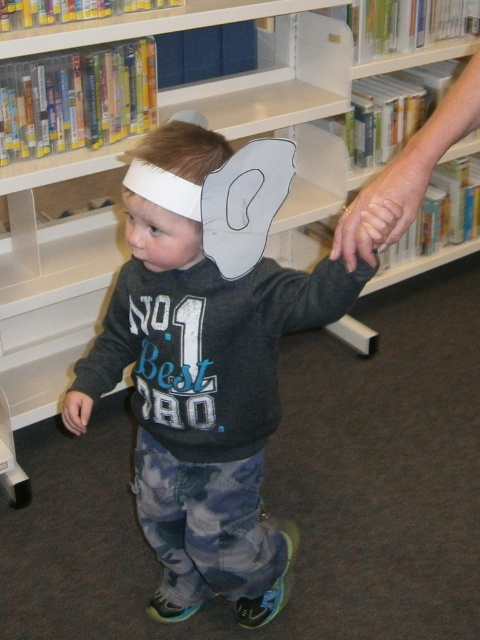
Question: Which of the following is the farthest from the observer?

Choices:
 (A) camouflage pants at center
 (B) smooth skin hand at center

Answer: (A)

Question: Where is camouflage pants at center located in relation to smooth skin hand at center in the image?

Choices:
 (A) left
 (B) right

Answer: (A)

Question: Does camouflage pants at center appear under smooth skin hand at center?

Choices:
 (A) yes
 (B) no

Answer: (A)

Question: Can you confirm if camouflage pants at center is positioned below smooth skin hand at center?

Choices:
 (A) yes
 (B) no

Answer: (A)

Question: Which of the following is the closest to the observer?

Choices:
 (A) camouflage pants at center
 (B) smooth skin hand at center

Answer: (B)

Question: Among these objects, which one is farthest from the camera?

Choices:
 (A) smooth skin hand at center
 (B) camouflage pants at center

Answer: (B)